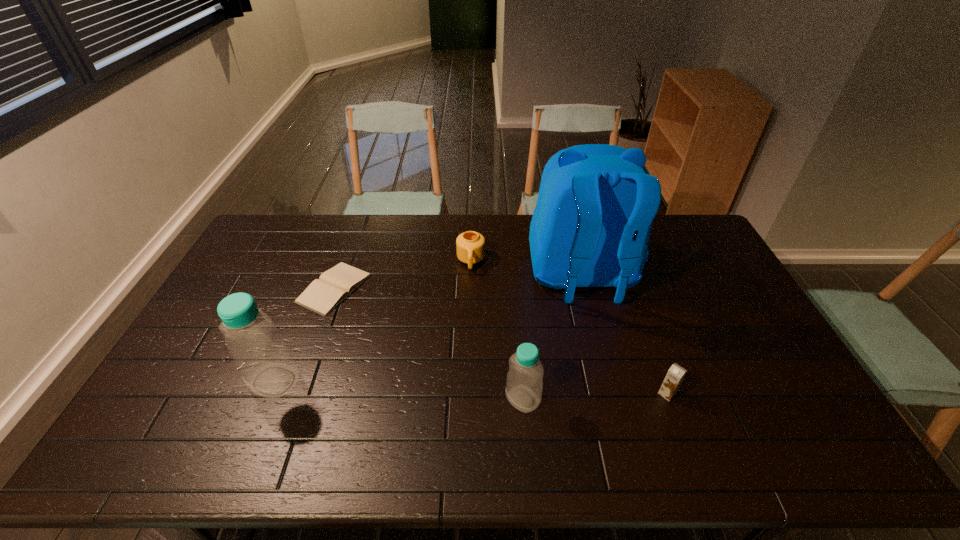
Where is `the taller bottle`? The width and height of the screenshot is (960, 540). the taller bottle is located at coordinates (267, 369).

Find the location of `the fifth shortest object`. the fifth shortest object is located at coordinates (267, 369).

Image resolution: width=960 pixels, height=540 pixels. I want to click on the right bottle, so click(524, 384).

Locate an element on the screen. the shorter bottle is located at coordinates (524, 384).

The image size is (960, 540). In order to click on backpack in this screenshot , I will do `click(596, 203)`.

The image size is (960, 540). What are the coordinates of `Bible` in the screenshot? It's located at (324, 294).

Find the location of `mug`. mug is located at coordinates (470, 246).

Where is `chocolate milk`? chocolate milk is located at coordinates (675, 375).

This screenshot has width=960, height=540. In order to click on vacant space positioned 0.320m on the right of the left bottle in this screenshot , I will do `click(419, 381)`.

Find the location of a particular element. The width and height of the screenshot is (960, 540). free spot located 0.150m on the right of the right bottle is located at coordinates [597, 399].